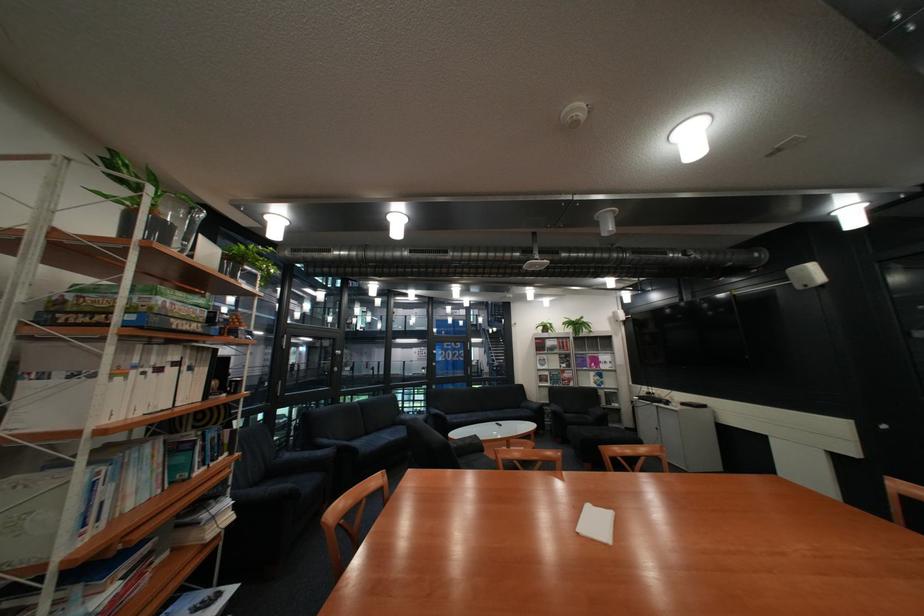
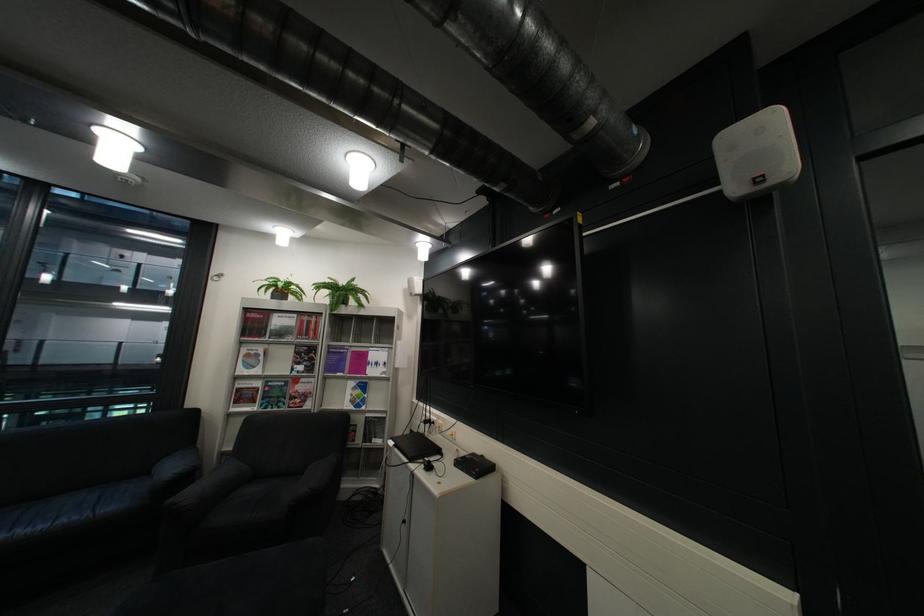
The point at (x=630, y=405) is marked in the first image. Where is the corresponding point in the second image?

(393, 442)